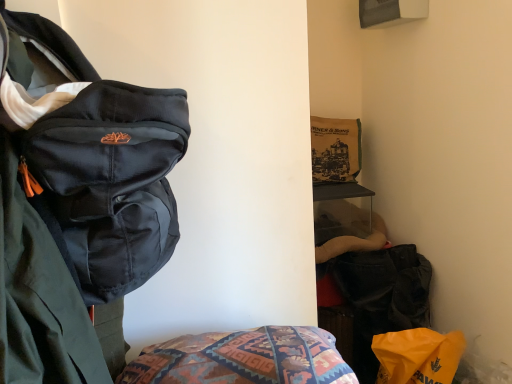
Question: Would you say matte black backpack at left is inside or outside velvet black bag at lower right?

Choices:
 (A) outside
 (B) inside

Answer: (A)

Question: Looking at their shapes, would you say matte black backpack at left is wider or thinner than velvet black bag at lower right?

Choices:
 (A) wide
 (B) thin

Answer: (A)

Question: Which object is positioned closest to the velvet black bag at lower right?

Choices:
 (A) matte black backpack at left
 (B) orange plastic bag at lower right

Answer: (B)

Question: Estimate the real-world distances between objects in this image. Which object is closer to the velvet black bag at lower right?

Choices:
 (A) matte black backpack at left
 (B) orange plastic bag at lower right

Answer: (B)